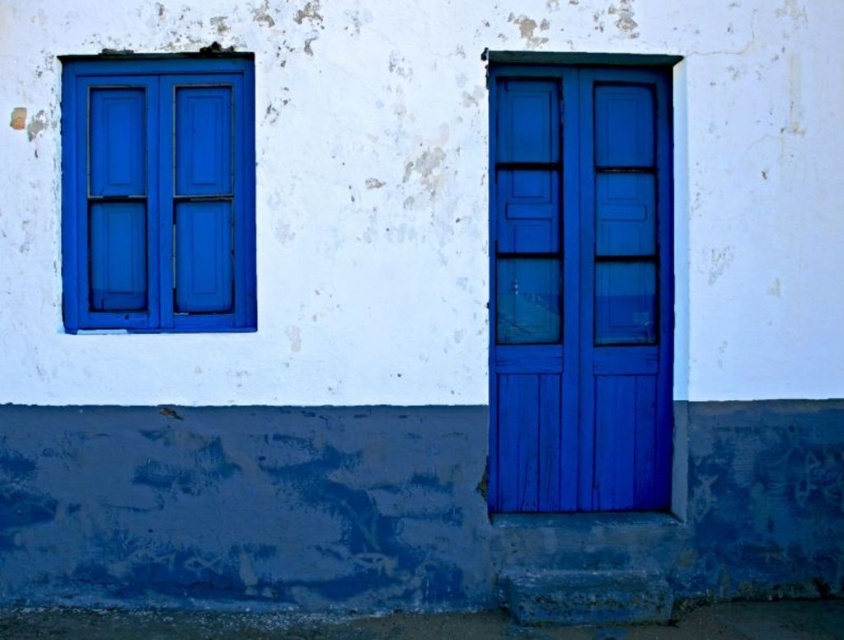
Question: Is the position of matte wood door at right more distant than that of matte blue window at upper left?

Choices:
 (A) no
 (B) yes

Answer: (A)

Question: Among these points, which one is nearest to the camera?

Choices:
 (A) (203, 211)
 (B) (620, 193)

Answer: (A)

Question: Is matte wood door at right bigger than matte blue window at upper left?

Choices:
 (A) no
 (B) yes

Answer: (B)

Question: Among these points, which one is nearest to the camera?

Choices:
 (A) (645, 182)
 (B) (241, 280)

Answer: (B)

Question: Is matte wood door at right thinner than matte blue window at upper left?

Choices:
 (A) no
 (B) yes

Answer: (B)

Question: Which point appears farthest from the camera in this image?

Choices:
 (A) (656, 508)
 (B) (215, 150)

Answer: (A)